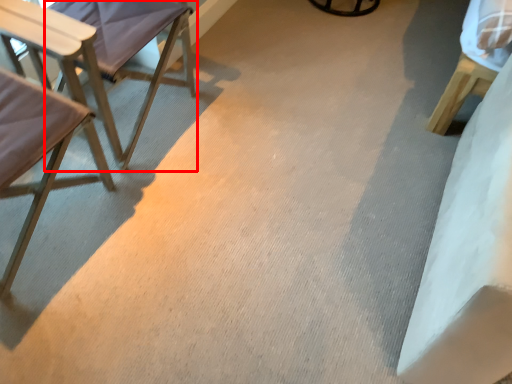
Question: From the image's perspective, what is the correct spatial relationship of chair (annotated by the red box) in relation to chair?

Choices:
 (A) below
 (B) above

Answer: (B)